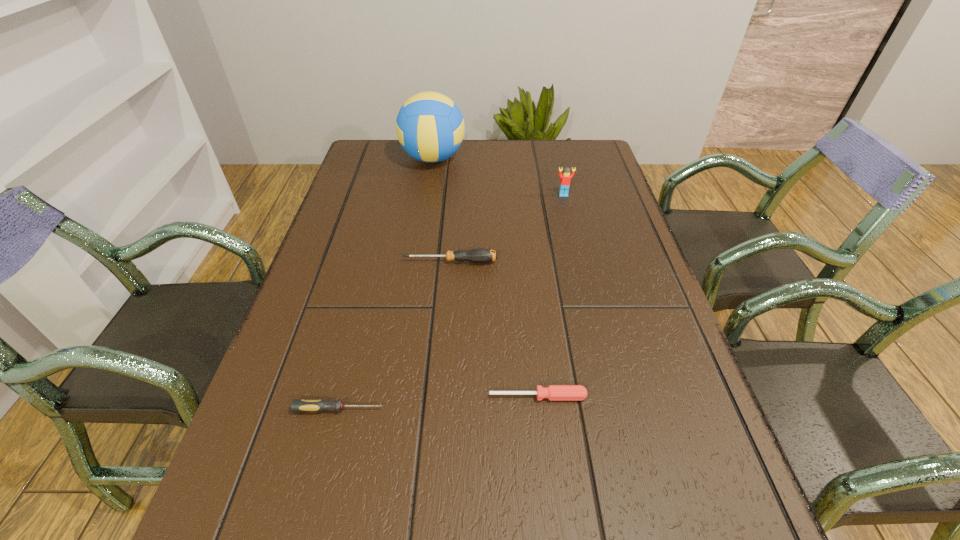
In order to click on vacant space at the right edge of the desktop in this screenshot , I will do `click(652, 487)`.

The height and width of the screenshot is (540, 960). In order to click on vacant space at the far right corner of the desktop in this screenshot , I will do `click(586, 141)`.

The height and width of the screenshot is (540, 960). Find the location of `free area in between the third nearest object and the fourth farthest object`. free area in between the third nearest object and the fourth farthest object is located at coordinates (x=494, y=329).

The height and width of the screenshot is (540, 960). I want to click on unoccupied area between the nearest object and the volleyball, so click(x=386, y=284).

The height and width of the screenshot is (540, 960). In order to click on vacant space that's between the Lego and the nearest screwdriver in this screenshot , I will do `click(451, 302)`.

Locate an element on the screen. The image size is (960, 540). free spot between the fourth farthest object and the rightmost object is located at coordinates (551, 295).

This screenshot has height=540, width=960. In order to click on vacant space that's between the fourth shortest object and the nearest screwdriver in this screenshot , I will do `click(451, 302)`.

The width and height of the screenshot is (960, 540). In order to click on empty space between the tallest object and the second nearest object in this screenshot , I will do `click(486, 278)`.

The image size is (960, 540). Identify the location of empty location between the third nearest object and the nearest screwdriver. (395, 335).

Locate an element on the screen. The height and width of the screenshot is (540, 960). empty space between the third shortest object and the farthest object is located at coordinates (442, 210).